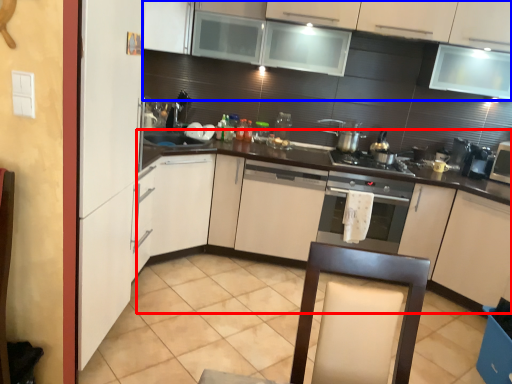
Question: Which object is closer to the camera taking this photo, counter (highlighted by a red box) or cabinetry (highlighted by a blue box)?

Choices:
 (A) counter
 (B) cabinetry

Answer: (B)